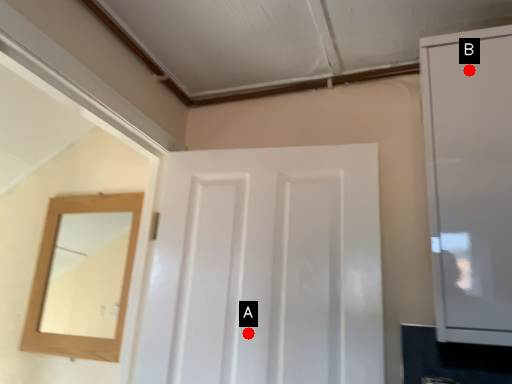
Question: Two points are circled on the image, labeled by A and B beside each circle. Which point is closer to the camera?

Choices:
 (A) A is closer
 (B) B is closer

Answer: (B)